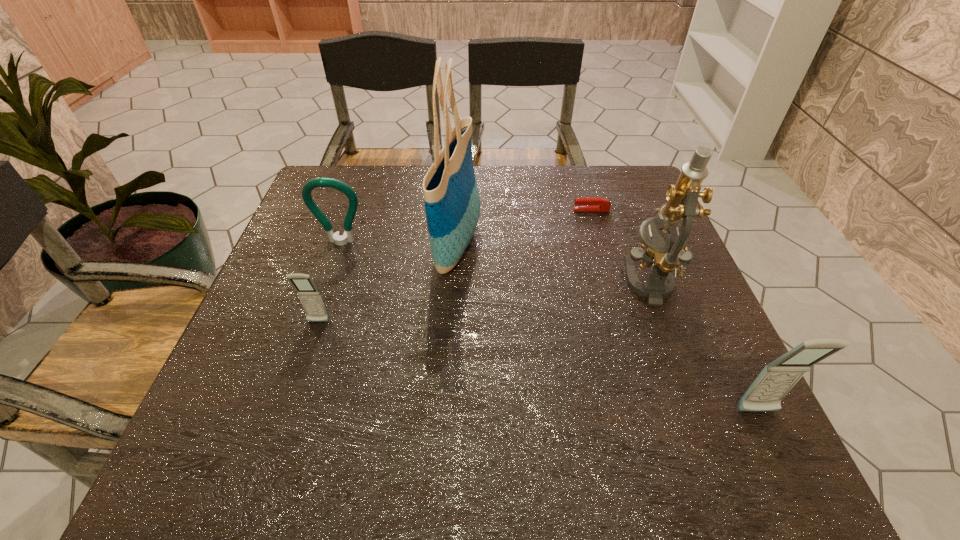
Find the location of a particular element. Image resolution: width=960 pixels, height=540 pixels. bottle opener that is at the left edge is located at coordinates (338, 239).

I want to click on cellular telephone at the right edge, so click(x=765, y=394).

Locate an element on the screen. stapler that is at the right edge is located at coordinates (589, 203).

The width and height of the screenshot is (960, 540). I want to click on microscope that is at the right edge, so click(668, 253).

Identify the location of object present at the far right corner. (589, 203).

Where is `object situated at the near right corner`? Image resolution: width=960 pixels, height=540 pixels. object situated at the near right corner is located at coordinates (765, 394).

This screenshot has height=540, width=960. In the image, there is a desktop. What are the coordinates of `free space at the far edge` in the screenshot? It's located at (417, 176).

Where is `vacant area at the near edge`? The width and height of the screenshot is (960, 540). vacant area at the near edge is located at coordinates (535, 420).

Image resolution: width=960 pixels, height=540 pixels. Find the location of `vacant area at the left edge of the desktop`. vacant area at the left edge of the desktop is located at coordinates (240, 360).

This screenshot has width=960, height=540. What are the coordinates of `vacant space at the right edge of the desktop` in the screenshot? It's located at (628, 251).